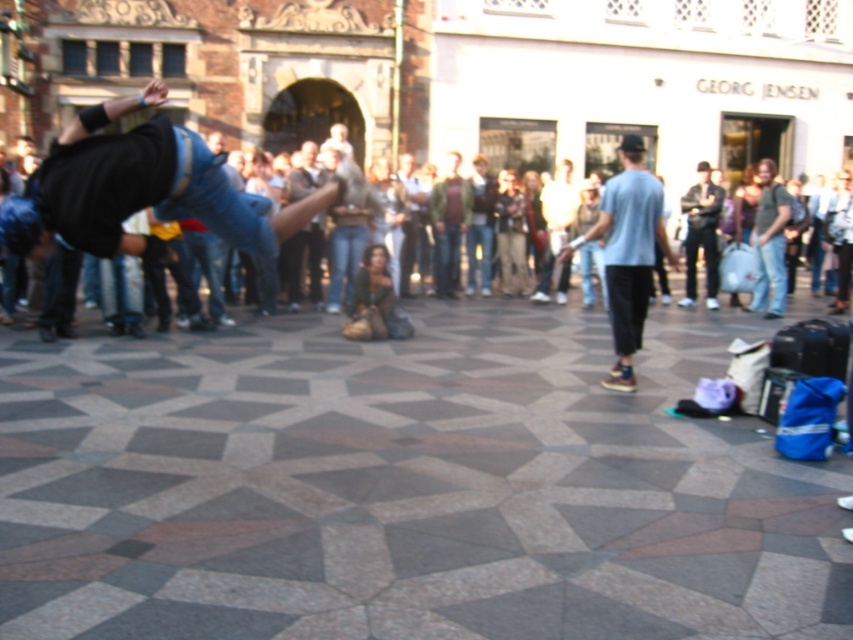
Does light blue t-shirt at center have a greater height compared to dark blue jeans at center?

No, light blue t-shirt at center is not taller than dark blue jeans at center.

Based on the photo, between light blue t-shirt at center and dark blue jeans at center, which one has more height?

With more height is dark blue jeans at center.

Where is `light blue t-shirt at center`? light blue t-shirt at center is located at coordinates (627, 252).

Which is more to the left, denim jeans at left or dark blue jeans at center?

denim jeans at left

Who is lower down, denim jeans at left or dark blue jeans at center?

denim jeans at left is below.

This screenshot has height=640, width=853. What do you see at coordinates (138, 188) in the screenshot?
I see `denim jeans at left` at bounding box center [138, 188].

Locate an element on the screen. This screenshot has width=853, height=640. denim jeans at left is located at coordinates (138, 188).

Can you confirm if jeans at center is bigger than denim jeans at left?

Actually, jeans at center might be smaller than denim jeans at left.

Can you confirm if jeans at center is positioned to the right of denim jeans at left?

In fact, jeans at center is to the left of denim jeans at left.

Describe the element at coordinates (141, 193) in the screenshot. I see `jeans at center` at that location.

The image size is (853, 640). Identify the location of jeans at center. (141, 193).